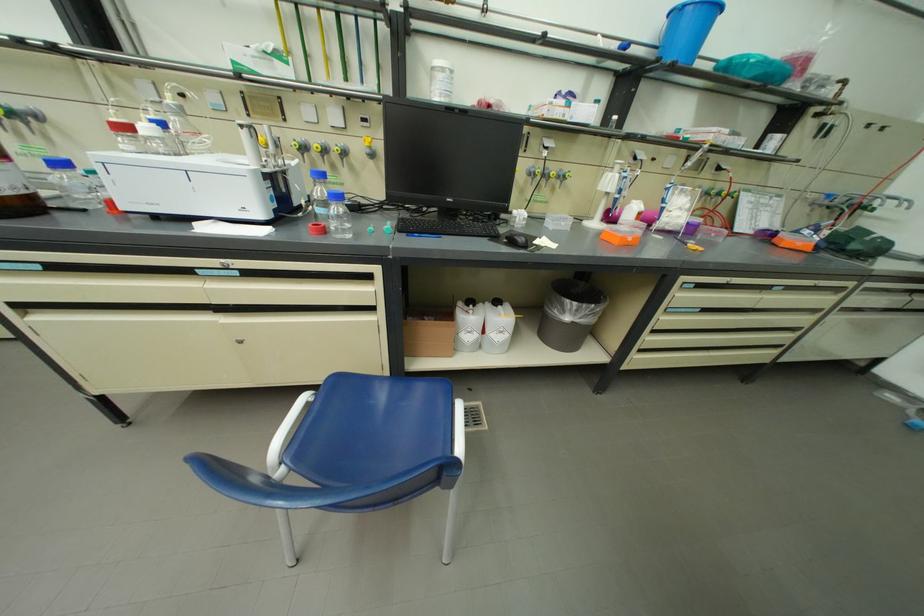
Find the location of a particular element. Image resolution: width=924 pixels, height=616 pixels. black computer mouse is located at coordinates (517, 238).